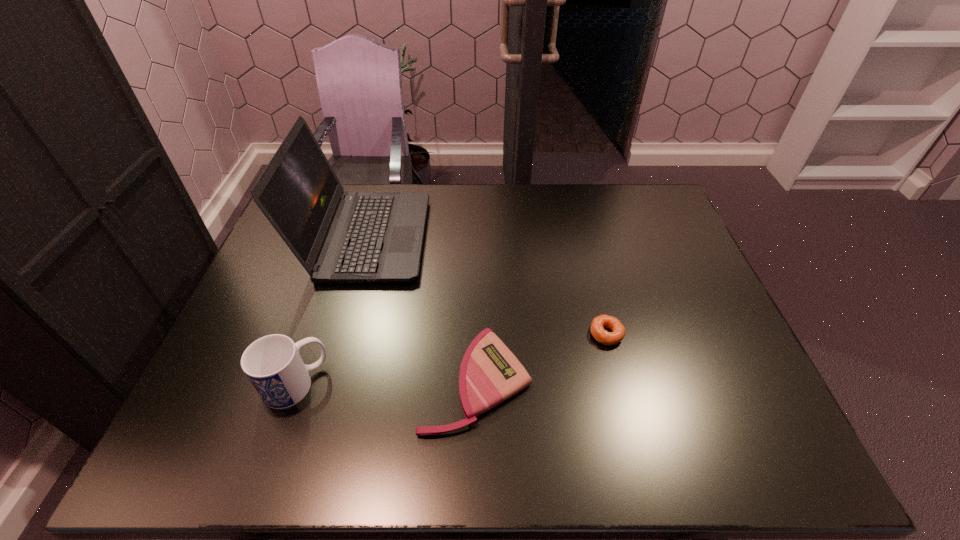
Identify the location of the farthest object. (338, 237).

You are a GUI agent. You are given a task and a screenshot of the screen. Output one action in this format:
    pyautogui.click(x=<x>, y=<y>)
    Task: Click on the tallest object
    
    Given the screenshot: What is the action you would take?
    pyautogui.click(x=338, y=237)

Image resolution: width=960 pixels, height=540 pixels. Find the location of `mug`. mug is located at coordinates (272, 363).

This screenshot has height=540, width=960. I want to click on the rightmost object, so click(602, 336).

Identify the location of the second object from right to left. click(x=490, y=373).

Identify the location of free space located on the screen of the farthest object. (510, 238).

Image resolution: width=960 pixels, height=540 pixels. What are the coordinates of `vacant space located 0.100m on the back of the third shortest object` in the screenshot? It's located at (314, 328).

Locate an element on the screen. Image resolution: width=960 pixels, height=540 pixels. vacant region located 0.140m on the right of the doughnut is located at coordinates click(678, 334).

Locate an element on the screen. vacant space located 0.350m on the right of the third object from left to right is located at coordinates (681, 381).

This screenshot has height=540, width=960. What are the coordinates of `object that is positioned at the far edge` in the screenshot? It's located at (338, 237).